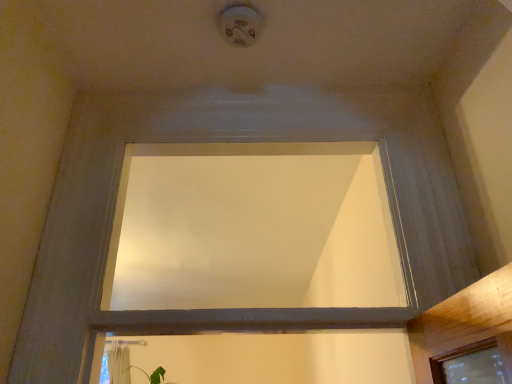
The width and height of the screenshot is (512, 384). I want to click on white matte window at center, so click(252, 228).

The height and width of the screenshot is (384, 512). What do you see at coordinates (252, 228) in the screenshot? I see `white matte window at center` at bounding box center [252, 228].

Measure the distance between white matte window at center and camera.

white matte window at center and camera are 1.05 meters apart from each other.

Where is `white matte window at center`? Image resolution: width=512 pixels, height=384 pixels. white matte window at center is located at coordinates (252, 228).